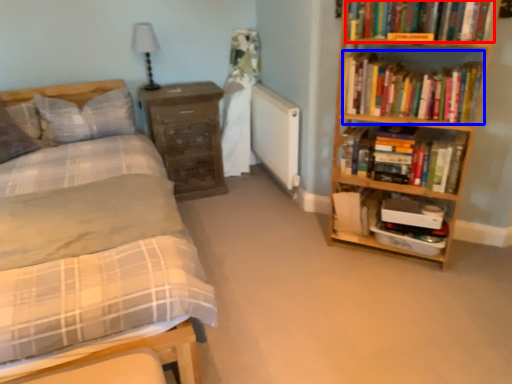
Question: Which object is closer to the camera taking this photo, book (highlighted by a red box) or book (highlighted by a blue box)?

Choices:
 (A) book
 (B) book

Answer: (A)